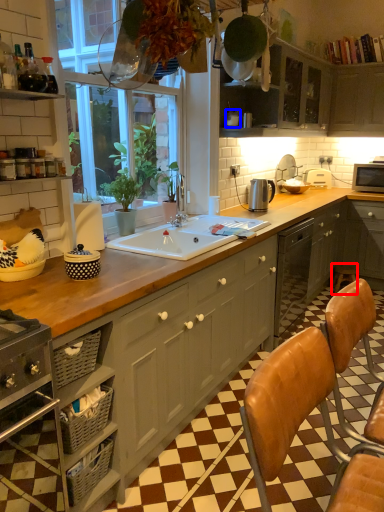
Question: Which of the following is the closest to the observer, bar stool (highlighted by a red box) or appliance (highlighted by a blue box)?

Choices:
 (A) bar stool
 (B) appliance

Answer: (B)